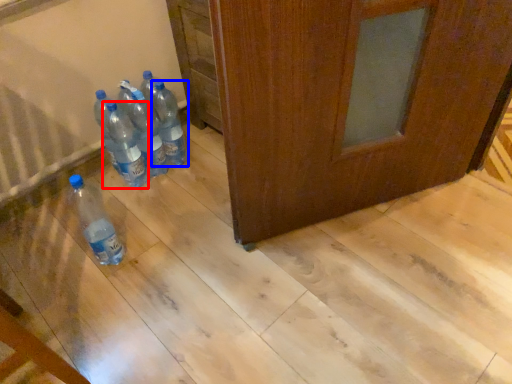
Question: Which object appears closest to the camera in this image, bottle (highlighted by a red box) or bottle (highlighted by a blue box)?

Choices:
 (A) bottle
 (B) bottle

Answer: (A)